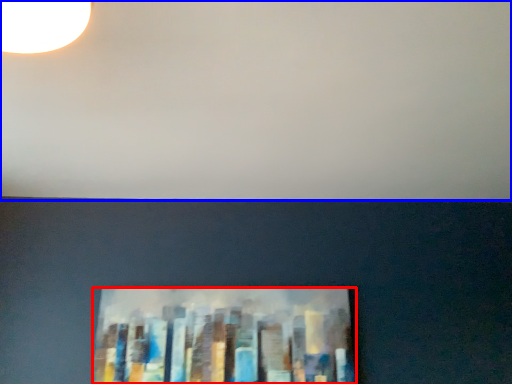
Question: Which object is closer to the camera taking this photo, picture frame (highlighted by a red box) or backdrop (highlighted by a blue box)?

Choices:
 (A) picture frame
 (B) backdrop

Answer: (B)